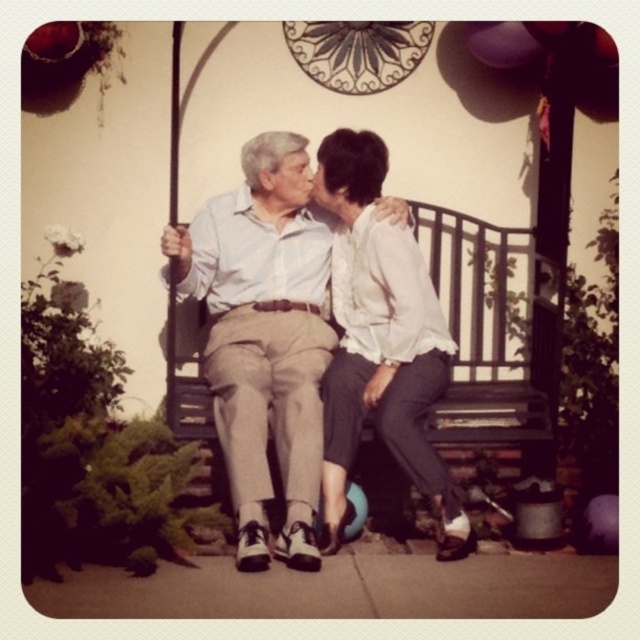
Consider the image. Who is lower down, light beige cotton pants at center or white satin blouse at upper right?

light beige cotton pants at center

Can you confirm if light beige cotton pants at center is shorter than white satin blouse at upper right?

No, light beige cotton pants at center is not shorter than white satin blouse at upper right.

Is point (292, 362) positioned in front of point (380, 419)?

No, it is behind (380, 419).

What are the coordinates of `light beige cotton pants at center` in the screenshot? It's located at (264, 337).